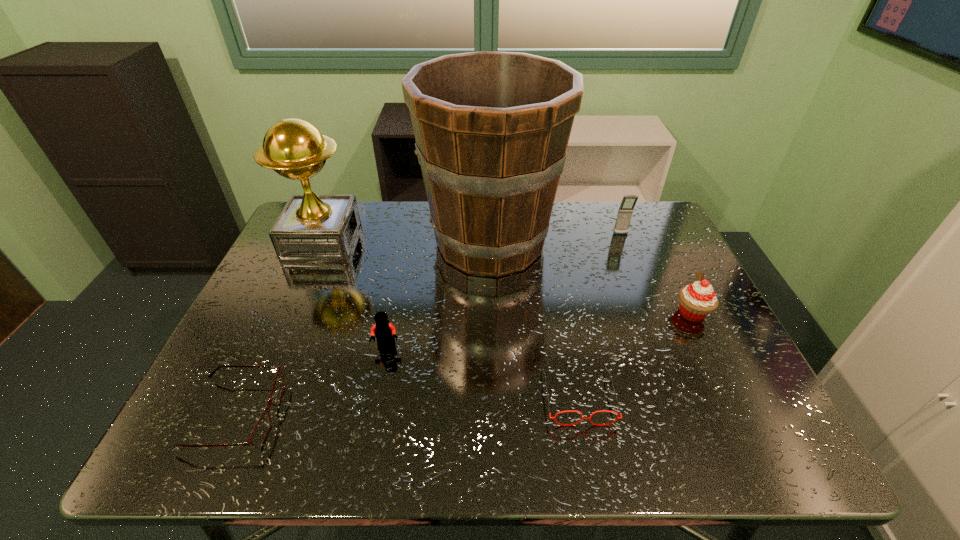
The height and width of the screenshot is (540, 960). Find the location of `bucket`. bucket is located at coordinates (492, 128).

The height and width of the screenshot is (540, 960). What are the coordinates of `the second tallest object` in the screenshot? It's located at (311, 228).

The height and width of the screenshot is (540, 960). Identify the location of cellular telephone. [x=625, y=212].

Find the location of a particular element. the third tallest object is located at coordinates (625, 212).

Where is `cupcake`? The height and width of the screenshot is (540, 960). cupcake is located at coordinates (697, 300).

Image resolution: width=960 pixels, height=540 pixels. Identify the location of the fourth farthest object. (697, 300).

Identify the location of the fifth farthest object. click(x=384, y=331).

This screenshot has width=960, height=540. Identify the location of the fifth object from right to left. (384, 331).

Locate an element on the screen. The image size is (960, 540). the right spectacles is located at coordinates (554, 417).

The height and width of the screenshot is (540, 960). What are the coordinates of `the left spectacles` in the screenshot? It's located at (260, 432).